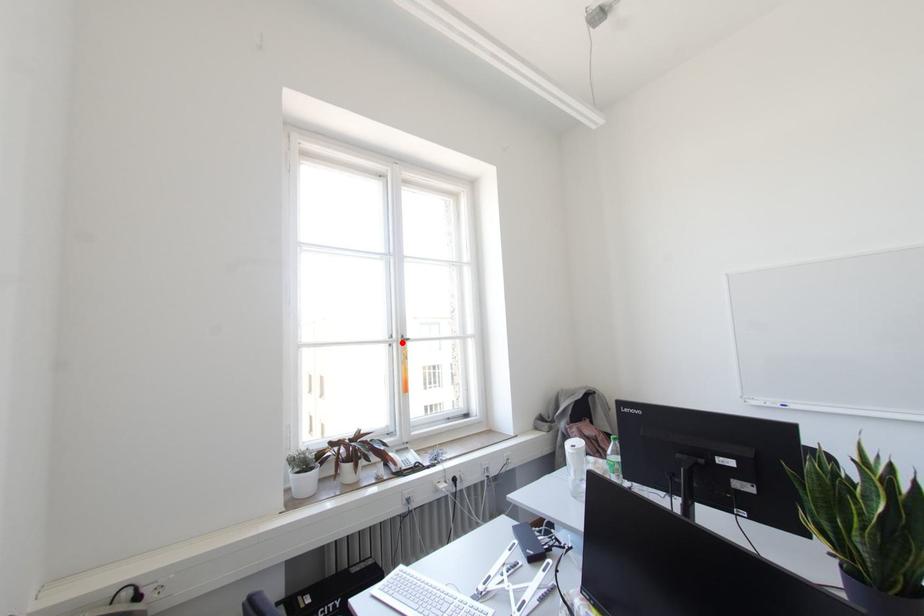
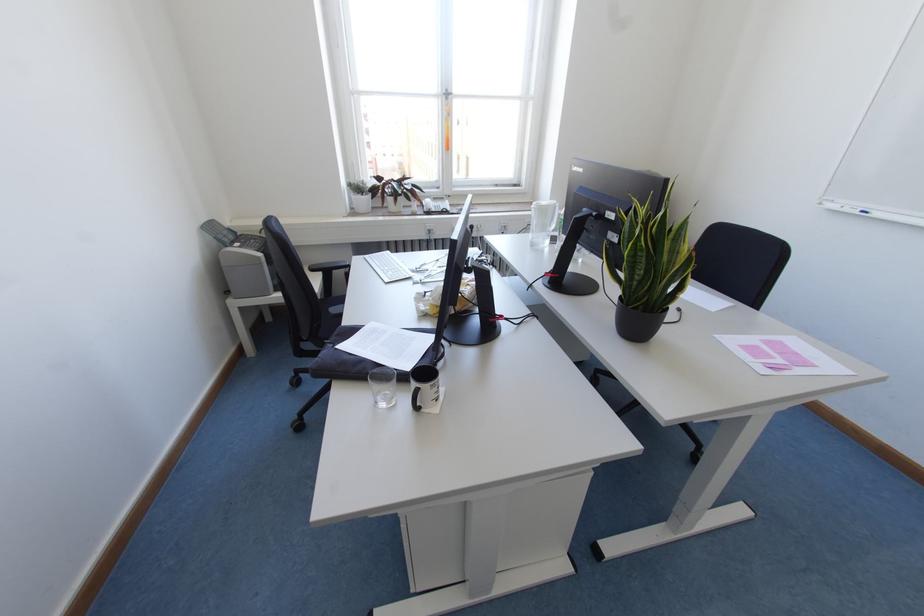
Question: I am providing you with two images of the same scene from different viewpoints. A red point is shown in image1. For the corresponding object point in image2, is it positioned nearer or farther from the camera?

Choices:
 (A) Nearer
 (B) Farther

Answer: (A)